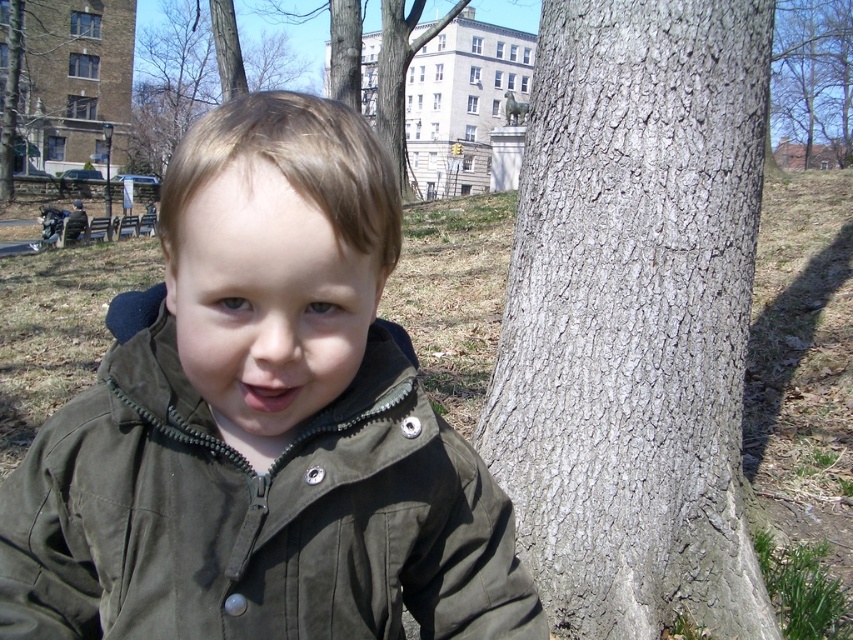
Based on the scene description, where is the gray rough bark at center located in the image?

The gray rough bark at center is located at point coordinates of approximately 0.495 on the x axis and 0.744 on the y axis.

You are a painter who wants to paint the scene. You notice two trees in the image. The first has gray rough bark at center and the second is the brown rough bark tree at upper left. Which tree should you paint first if you want to start with the thicker tree?

You should start with the brown rough bark tree at upper left because it is thicker than the gray rough bark at center.

You are a nature photographer trying to capture a photo of the gray rough bark at center and the brown rough bark tree at upper left. Which tree should you focus on if you want to photograph the taller one?

The brown rough bark tree at upper left is taller than the gray rough bark at center, so you should focus on the brown rough bark tree at upper left to photograph the taller one.